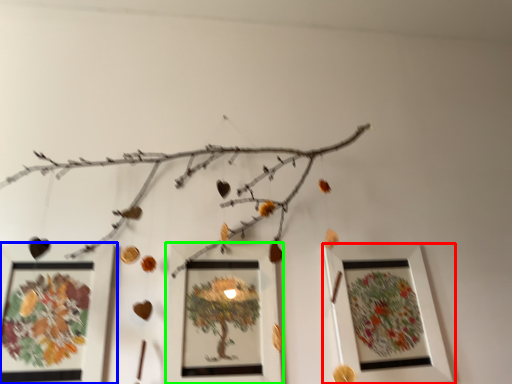
Question: Which is farther away from picture frame (highlighted by a red box)? picture frame (highlighted by a blue box) or picture frame (highlighted by a green box)?

Choices:
 (A) picture frame
 (B) picture frame

Answer: (A)